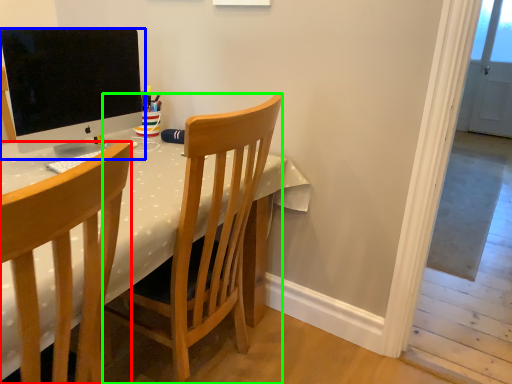
Question: Which is farther away from chair (highlighted by a red box)? computer monitor (highlighted by a blue box) or chair (highlighted by a green box)?

Choices:
 (A) computer monitor
 (B) chair

Answer: (A)